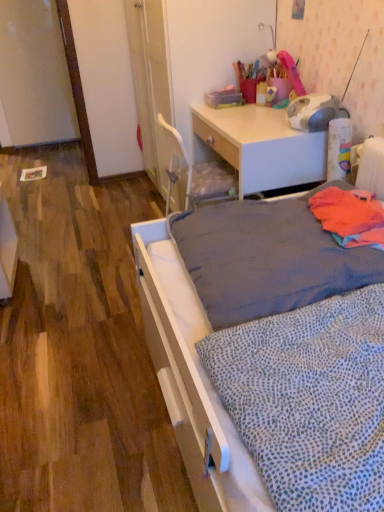
Measure the distance between point (318, 440) and camera.

A distance of 32.01 inches exists between point (318, 440) and camera.

What is the approximate height of white glossy desk at upper center?

white glossy desk at upper center is 24.54 inches tall.

At what (x,y) coordinates should I click in order to perform the action: click on gray fabric mattress at center. Please return your answer as a coordinate pair (x, y). This screenshot has height=512, width=384. Looking at the image, I should click on (267, 258).

Which object is wider, white dotted fabric at lower right, which appears as the first blanket when viewed from the front, or white glossy desk at upper center?

With larger width is white dotted fabric at lower right, which appears as the first blanket when viewed from the front.

What's the angular difference between white dotted fabric at lower right, the 1th blanket from the bottom, and white glossy desk at upper center's facing directions?

0.000251 degrees separate the facing orientations of white dotted fabric at lower right, the 1th blanket from the bottom, and white glossy desk at upper center.

Can you confirm if white dotted fabric at lower right, which appears as the first blanket when viewed from the front, is smaller than white glossy desk at upper center?

Correct, white dotted fabric at lower right, which appears as the first blanket when viewed from the front, occupies less space than white glossy desk at upper center.

Is white glossy desk at upper center located within orange fabric at right, which is counted as the first blanket, starting from the top?

No, white glossy desk at upper center is not surrounded by orange fabric at right, which is counted as the first blanket, starting from the top.

In terms of height, does orange fabric at right, marked as the first blanket in a back-to-front arrangement, look taller or shorter compared to white glossy desk at upper center?

Clearly, orange fabric at right, marked as the first blanket in a back-to-front arrangement, is shorter compared to white glossy desk at upper center.

Is point (329, 213) in front of point (217, 114)?

Yes.

Are white glossy desk at upper center and white dotted fabric at lower right, the 2th blanket positioned from the top, far apart?

Actually, white glossy desk at upper center and white dotted fabric at lower right, the 2th blanket positioned from the top, are a little close together.

Is white glossy desk at upper center further to the viewer compared to white dotted fabric at lower right, which appears as the first blanket when viewed from the front?

Yes, it is behind white dotted fabric at lower right, which appears as the first blanket when viewed from the front.

From the image's perspective, which is below, white glossy desk at upper center or white dotted fabric at lower right, the 2th blanket viewed from the back?

white dotted fabric at lower right, the 2th blanket viewed from the back, is shown below in the image.

From a real-world perspective, which is physically below, white glossy desk at upper center or white dotted fabric at lower right, the 1th blanket from the bottom?

In real-world perspective, white glossy desk at upper center is lower.

Is orange fabric at right, marked as the first blanket in a back-to-front arrangement, looking in the opposite direction of gray fabric mattress at center?

No, orange fabric at right, marked as the first blanket in a back-to-front arrangement, is not facing away from gray fabric mattress at center.

Does orange fabric at right, arranged as the 2th blanket when ordered from the bottom, have a larger size compared to gray fabric mattress at center?

No, orange fabric at right, arranged as the 2th blanket when ordered from the bottom, is not bigger than gray fabric mattress at center.

Does point (366, 244) lie behind point (277, 232)?

No, it is not.

Is orange fabric at right, marked as the first blanket in a back-to-front arrangement, shorter than gray fabric mattress at center?

Indeed, orange fabric at right, marked as the first blanket in a back-to-front arrangement, has a lesser height compared to gray fabric mattress at center.

Considering the sizes of objects orange fabric at right, marked as the first blanket in a back-to-front arrangement, and white dotted fabric at lower right, the 2th blanket viewed from the back, in the image provided, who is shorter, orange fabric at right, marked as the first blanket in a back-to-front arrangement, or white dotted fabric at lower right, the 2th blanket viewed from the back,?

Standing shorter between the two is orange fabric at right, marked as the first blanket in a back-to-front arrangement.

Consider the image. Does orange fabric at right, which is counted as the first blanket, starting from the top, have a smaller size compared to white dotted fabric at lower right, the 2th blanket positioned from the top?

Correct, orange fabric at right, which is counted as the first blanket, starting from the top, occupies less space than white dotted fabric at lower right, the 2th blanket positioned from the top.

Is the position of orange fabric at right, the second blanket from the front, less distant than that of white dotted fabric at lower right, the 1th blanket from the bottom?

That is False.

Visually, is gray fabric mattress at center positioned to the left or to the right of orange fabric at right, which is counted as the first blanket, starting from the top?

Based on their positions, gray fabric mattress at center is located to the left of orange fabric at right, which is counted as the first blanket, starting from the top.

From the picture: Is gray fabric mattress at center not within orange fabric at right, marked as the first blanket in a back-to-front arrangement?

Indeed, gray fabric mattress at center is completely outside orange fabric at right, marked as the first blanket in a back-to-front arrangement.

From a real-world perspective, relative to orange fabric at right, which is counted as the first blanket, starting from the top, is gray fabric mattress at center vertically above or below?

gray fabric mattress at center is below orange fabric at right, which is counted as the first blanket, starting from the top.

Would you say gray fabric mattress at center is a long distance from orange fabric at right, which is counted as the first blanket, starting from the top?

No, gray fabric mattress at center is not far away from orange fabric at right, which is counted as the first blanket, starting from the top.

Does point (239, 294) come behind point (319, 157)?

No.

Considering the relative sizes of gray fabric mattress at center and white glossy desk at upper center in the image provided, is gray fabric mattress at center taller than white glossy desk at upper center?

No.

From the picture: From the image's perspective, between gray fabric mattress at center and white glossy desk at upper center, which one is located above?

white glossy desk at upper center, from the image's perspective.

Looking at this image, which of these two, gray fabric mattress at center or white glossy desk at upper center, is thinner?

white glossy desk at upper center.

Identify the location of the 1st blanket directly above the white glossy desk at upper center (from a real-world perspective). (309, 400).

Locate an element on the screen. Image resolution: width=384 pixels, height=512 pixels. desk lying on the left of orange fabric at right, which is counted as the first blanket, starting from the top is located at coordinates (262, 146).

Based on their spatial positions, is white dotted fabric at lower right, the 2th blanket positioned from the top, or white glossy desk at upper center further from orange fabric at right, marked as the first blanket in a back-to-front arrangement?

white glossy desk at upper center is further to orange fabric at right, marked as the first blanket in a back-to-front arrangement.

From the picture: Considering their positions, is gray fabric mattress at center positioned closer to white dotted fabric at lower right, the 2th blanket viewed from the back, than orange fabric at right, marked as the first blanket in a back-to-front arrangement?

The object closer to white dotted fabric at lower right, the 2th blanket viewed from the back, is gray fabric mattress at center.

Looking at the image, which one is located further to gray fabric mattress at center, white dotted fabric at lower right, the 2th blanket viewed from the back, or orange fabric at right, marked as the first blanket in a back-to-front arrangement?

The object further to gray fabric mattress at center is white dotted fabric at lower right, the 2th blanket viewed from the back.

Looking at this image, estimate the real-world distances between objects in this image. Which object is closer to orange fabric at right, the second blanket from the front, white dotted fabric at lower right, which appears as the first blanket when viewed from the front, or gray fabric mattress at center?

gray fabric mattress at center.

Looking at the image, which one is located further to gray fabric mattress at center, white glossy desk at upper center or orange fabric at right, which is counted as the first blanket, starting from the top?

white glossy desk at upper center.

Looking at this image, from the image, which object appears to be farther from white dotted fabric at lower right, the 1th blanket from the bottom, white glossy desk at upper center or gray fabric mattress at center?

white glossy desk at upper center lies further to white dotted fabric at lower right, the 1th blanket from the bottom, than the other object.

Considering their positions, is gray fabric mattress at center positioned closer to white glossy desk at upper center than white dotted fabric at lower right, the 2th blanket viewed from the back?

Among the two, gray fabric mattress at center is located nearer to white glossy desk at upper center.

Based on the photo, estimate the real-world distances between objects in this image. Which object is further from orange fabric at right, marked as the first blanket in a back-to-front arrangement, white glossy desk at upper center or white dotted fabric at lower right, the 2th blanket viewed from the back?

white glossy desk at upper center is further to orange fabric at right, marked as the first blanket in a back-to-front arrangement.

You are a GUI agent. You are given a task and a screenshot of the screen. Output one action in this format:
    pyautogui.click(x=<x>, y=<y>)
    Task: Click on the blanket between gray fabric mattress at center and white glossy desk at upper center in the front-back direction
    Image resolution: width=384 pixels, height=512 pixels.
    Given the screenshot: What is the action you would take?
    pyautogui.click(x=350, y=216)

You are a GUI agent. You are given a task and a screenshot of the screen. Output one action in this format:
    pyautogui.click(x=<x>, y=<y>)
    Task: Click on the mattress between white dotted fabric at lower right, the 1th blanket from the bottom, and white glossy desk at upper center from front to back
    The width and height of the screenshot is (384, 512).
    Given the screenshot: What is the action you would take?
    pyautogui.click(x=267, y=258)

This screenshot has width=384, height=512. In order to click on mattress between white dotted fabric at lower right, which appears as the first blanket when viewed from the front, and orange fabric at right, marked as the first blanket in a back-to-front arrangement, along the z-axis in this screenshot , I will do coord(267,258).

Locate an element on the screen. This screenshot has width=384, height=512. blanket between white dotted fabric at lower right, the 2th blanket positioned from the top, and white glossy desk at upper center in the front-back direction is located at coordinates click(350, 216).